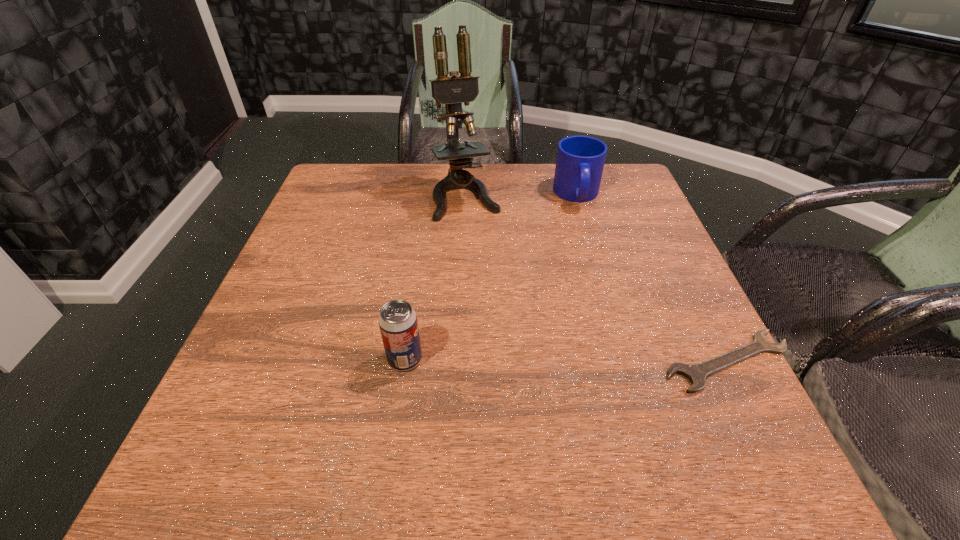
Locate an element on the screen. The height and width of the screenshot is (540, 960). vacant area that lies between the tallest object and the third object from left to right is located at coordinates (521, 196).

You are a GUI agent. You are given a task and a screenshot of the screen. Output one action in this format:
    pyautogui.click(x=<x>, y=<y>)
    Task: Click on the unoccupied area between the rightmost object and the microscope
    The height and width of the screenshot is (540, 960).
    Given the screenshot: What is the action you would take?
    pyautogui.click(x=597, y=279)

Locate an element on the screen. The width and height of the screenshot is (960, 540). unoccupied position between the beer can and the third object from left to right is located at coordinates (491, 277).

You are a GUI agent. You are given a task and a screenshot of the screen. Output one action in this format:
    pyautogui.click(x=<x>, y=<y>)
    Task: Click on the free space that is in between the beer can and the microscope
    
    Given the screenshot: What is the action you would take?
    pyautogui.click(x=436, y=278)

Identify the location of vacant space in between the wrench and the microscope. (597, 279).

Locate an element on the screen. free spot between the tallest object and the beer can is located at coordinates (436, 278).

Where is `free spot between the shortest object and the mug`? The image size is (960, 540). free spot between the shortest object and the mug is located at coordinates (652, 278).

Locate which object ranks third in proximity to the microscope. Please provide its 2D coordinates. Your answer should be formatted as a tuple, i.e. [(x, y)], where the tuple contains the x and y coordinates of a point satisfying the conditions above.

[(696, 373)]

The image size is (960, 540). Find the location of `object that is the second closest to the second object from right to left`. object that is the second closest to the second object from right to left is located at coordinates (696, 373).

The image size is (960, 540). What are the coordinates of `vacant position in the image that satisfies the following two spatial constraints: 1. on the back side of the beer can; 2. on the left side of the tallest object` in the screenshot? It's located at (429, 197).